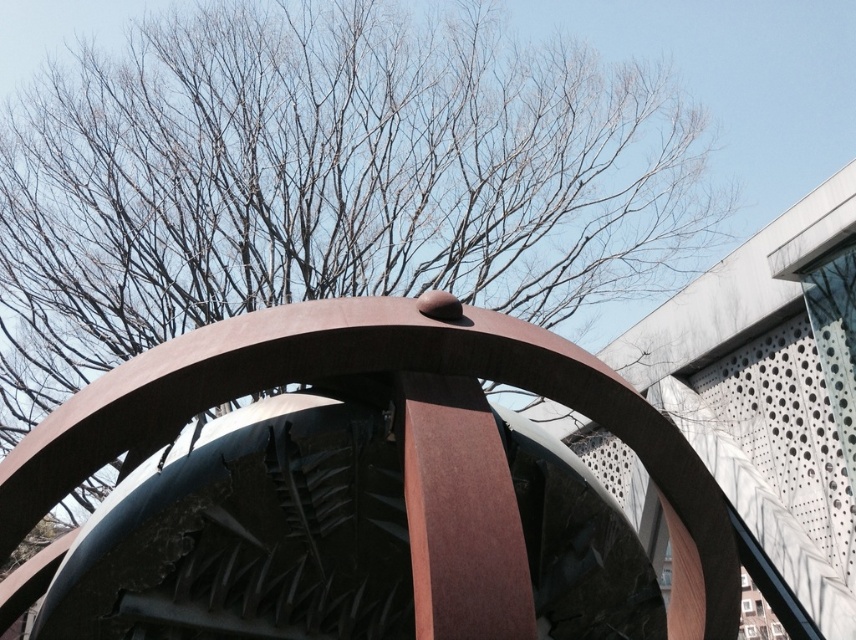
You are an urban planner assessing the space between the brown leafless tree at upper center and the rusty metal sculpture at center. Based on their heights, which object would cast a longer shadow during midday when the sun is directly overhead?

The brown leafless tree at upper center is much taller than the rusty metal sculpture at center, so it would cast a longer shadow during midday when the sun is directly overhead.

You are standing in the modern architectural scene and want to take a photo of both the brown leafless tree at upper center and the rusty metal sculpture at center. Which object should you focus on first to ensure both are in sharp focus?

You should focus on the brown leafless tree at upper center first because it is closer to you than the rusty metal sculpture at center. By focusing on the closer object, the sculpture will also be in focus due to the depth of field.